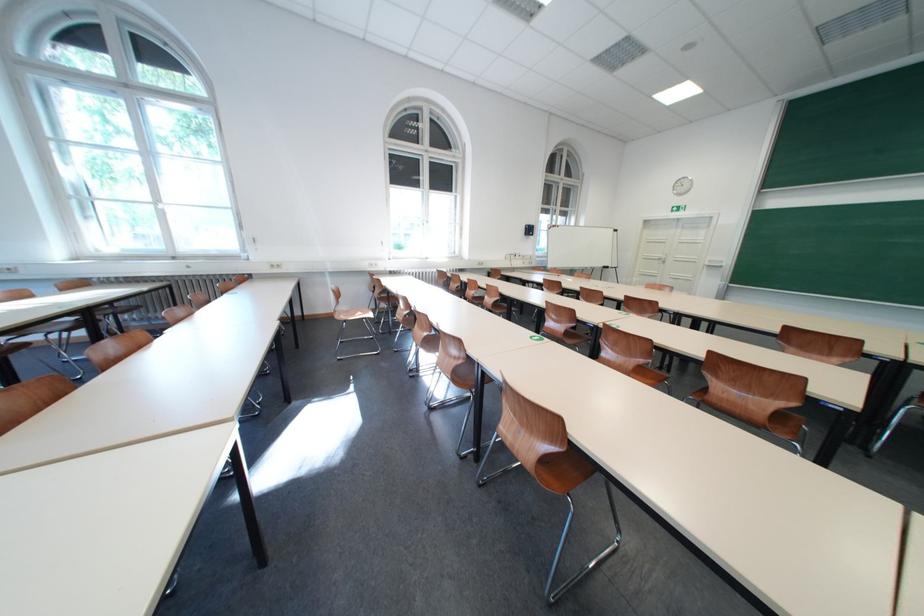
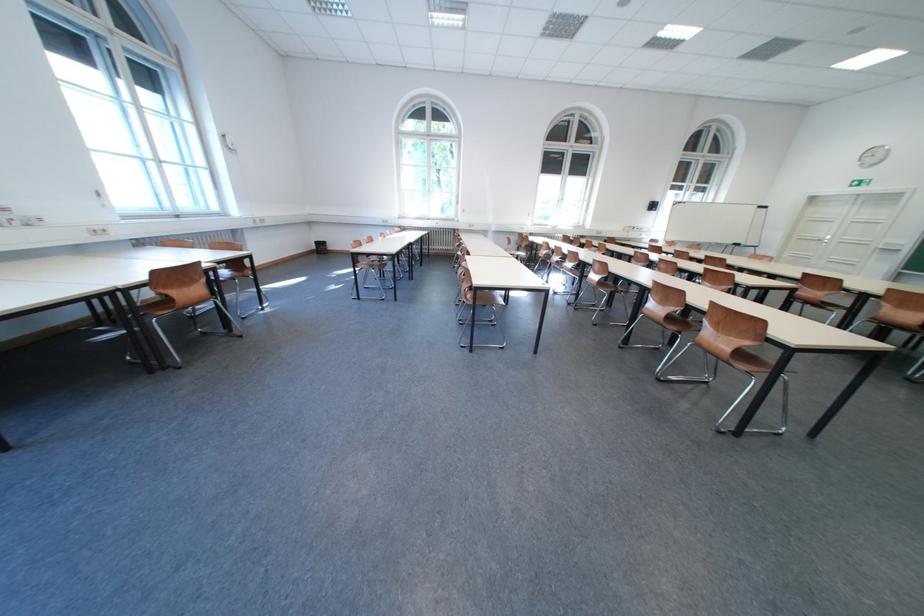
Find the pixel in the second image that matches point (789, 331) in the first image.

(813, 278)